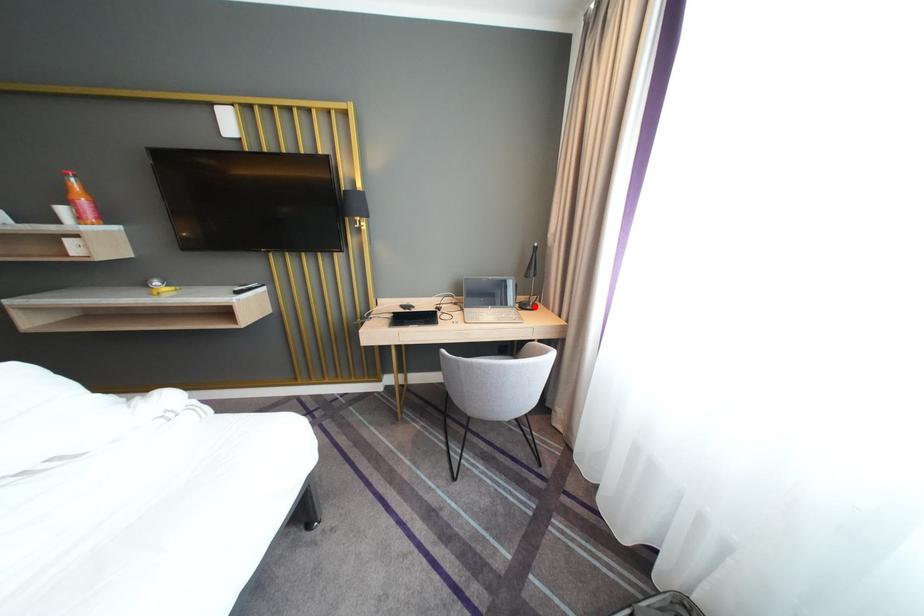
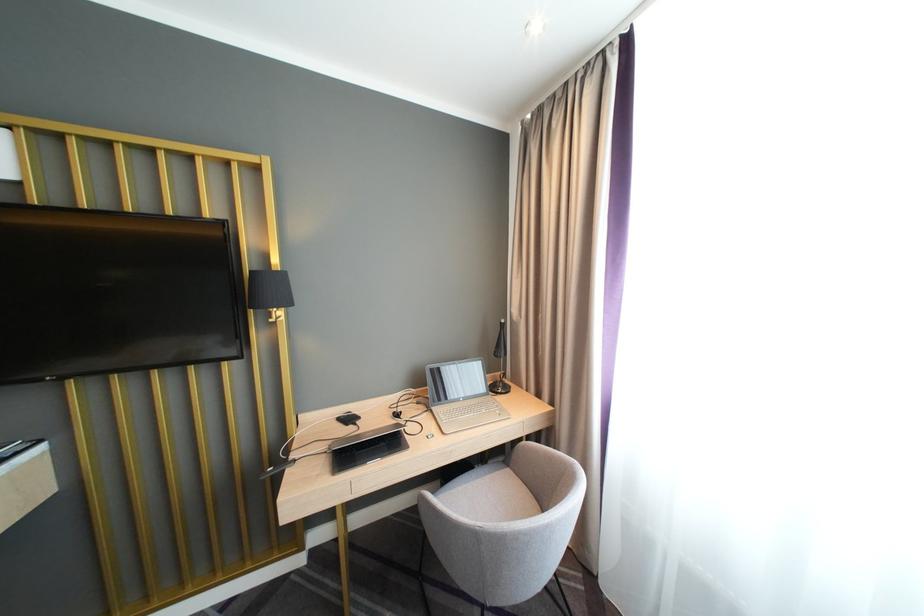
Locate, in the second image, the point that corresponds to the highlighted location in the first image.

(505, 390)